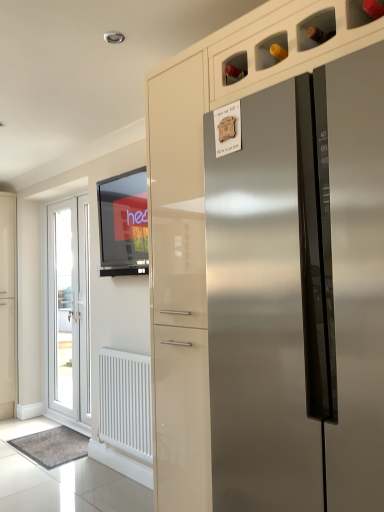
Question: Is white matte radiator at lower left bigger or smaller than matte black tv at upper left?

Choices:
 (A) big
 (B) small

Answer: (A)

Question: Is white matte radiator at lower left taller or shorter than matte black tv at upper left?

Choices:
 (A) short
 (B) tall

Answer: (B)

Question: Based on their relative distances, which object is farther from the stainless steel refrigerator at center?

Choices:
 (A) white matte radiator at lower left
 (B) matte black tv at upper left
 (C) white glossy door at left

Answer: (C)

Question: Estimate the real-world distances between objects in this image. Which object is farther from the white glossy door at left?

Choices:
 (A) matte black tv at upper left
 (B) white matte radiator at lower left
 (C) stainless steel refrigerator at center

Answer: (C)